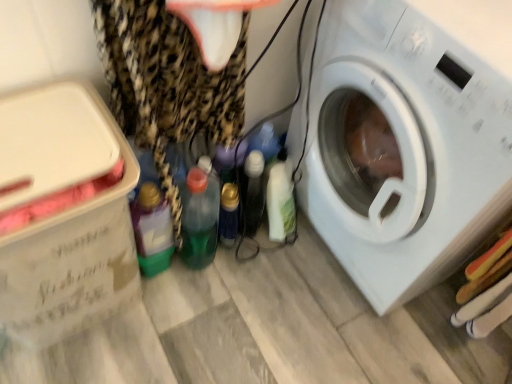
Question: From a real-world perspective, is white cardboard box at left positioned above or below translucent green plastic bottle at lower left, which appears as the 1th bottle when viewed from the left?

Choices:
 (A) below
 (B) above

Answer: (B)

Question: Is white cardboard box at left bigger or smaller than translucent green plastic bottle at lower left, which appears as the 1th bottle when viewed from the left?

Choices:
 (A) small
 (B) big

Answer: (B)

Question: Estimate the real-world distances between objects in this image. Which object is farther from the green translucent bottle at center, the second bottle in the left-to-right sequence?

Choices:
 (A) white cardboard box at left
 (B) translucent green plastic bottle at lower left, the fourth bottle when ordered from right to left
 (C) white plastic washing machine at right
 (D) white glossy bottle at center, marked as the first bottle in a right-to-left arrangement
 (E) leopard print fabric at left

Answer: (C)

Question: Estimate the real-world distances between objects in this image. Which object is closer to the translucent plastic bottle at center, marked as the second bottle in a right-to-left arrangement?

Choices:
 (A) white cardboard box at left
 (B) leopard print fabric at left
 (C) white plastic washing machine at right
 (D) translucent green plastic bottle at lower left, the fourth bottle when ordered from right to left
 (E) white glossy bottle at center, marked as the first bottle in a right-to-left arrangement

Answer: (E)